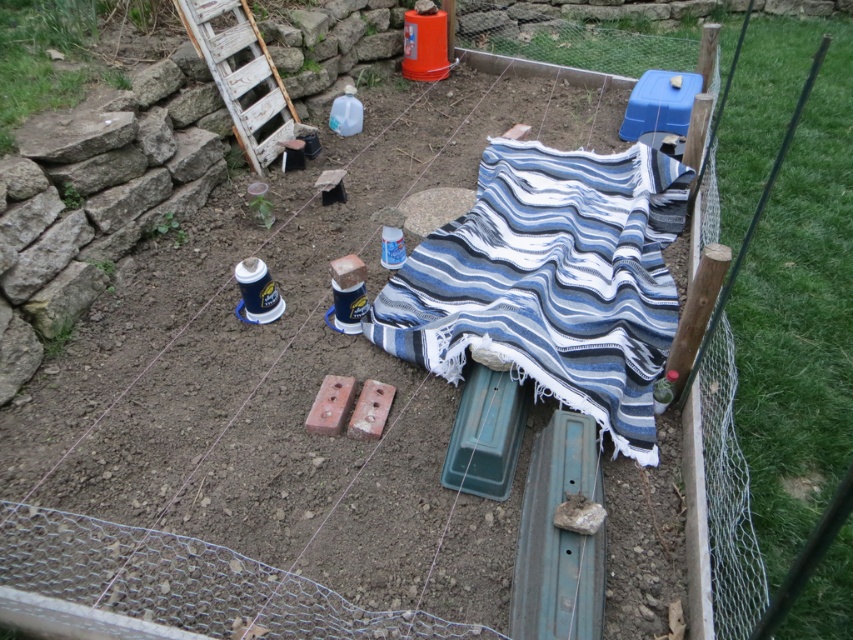
You need to place a 1.5 meter wide plant pot in the garden. The blue striped fabric at center and the white weathered wood ladder at upper left are in the way. Which object should you move to make space?

The blue striped fabric at center should be moved because it is wider than the white weathered wood ladder at upper left, so it occupies more space and would require more adjustment to accommodate the plant pot.

Looking at this image, you are standing in the garden and want to place a new potted plant between the blue striped fabric at center and the white weathered wood ladder at upper left. Which object should the plant be closer to if you want it to be nearer to the front of the garden?

The blue striped fabric at center is closer to the viewer than the white weathered wood ladder at upper left, so the plant should be placed closer to the blue striped fabric at center to be nearer the front.